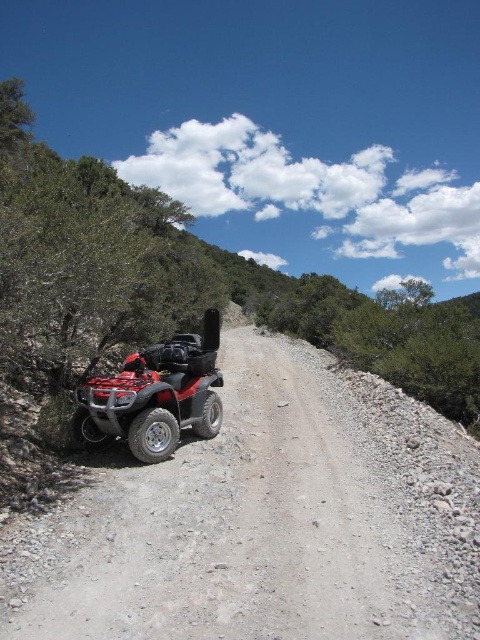
Question: Is the position of dirt gravel at left more distant than that of red matte quad bike at left?

Choices:
 (A) yes
 (B) no

Answer: (B)

Question: Is dirt gravel at left above red matte quad bike at left?

Choices:
 (A) yes
 (B) no

Answer: (B)

Question: Which of the following is the closest to the observer?

Choices:
 (A) (106, 438)
 (B) (337, 429)

Answer: (A)

Question: Is dirt gravel at left above red matte quad bike at left?

Choices:
 (A) no
 (B) yes

Answer: (A)

Question: Which of the following is the farthest from the observer?

Choices:
 (A) red matte quad bike at left
 (B) dirt gravel at left

Answer: (A)

Question: Which of the following is the closest to the observer?

Choices:
 (A) red matte quad bike at left
 (B) dirt gravel at left

Answer: (B)